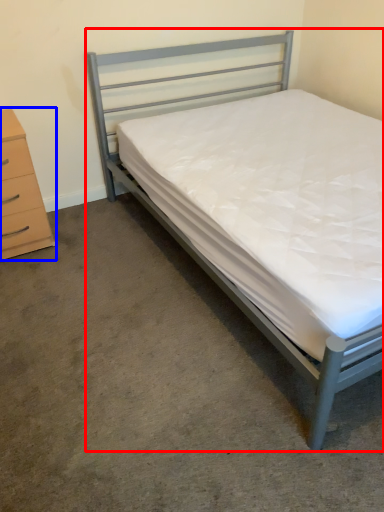
Question: Which point is further to the camera, bed (highlighted by a red box) or chest of drawers (highlighted by a blue box)?

Choices:
 (A) bed
 (B) chest of drawers

Answer: (B)